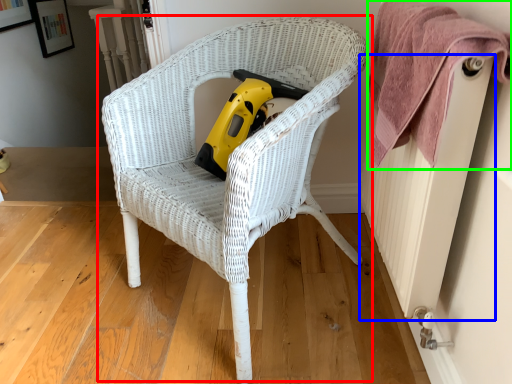
Question: Based on their relative distances, which object is nearer to chair (highlighted by a red box)? Choose from radiator (highlighted by a blue box) and towel (highlighted by a green box).

Choices:
 (A) radiator
 (B) towel

Answer: (B)